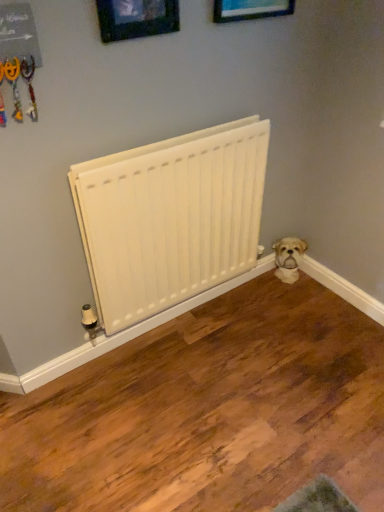
Find the location of a particular element. The image size is (384, 512). vacant area in front of white fluffy dog at lower right is located at coordinates (302, 296).